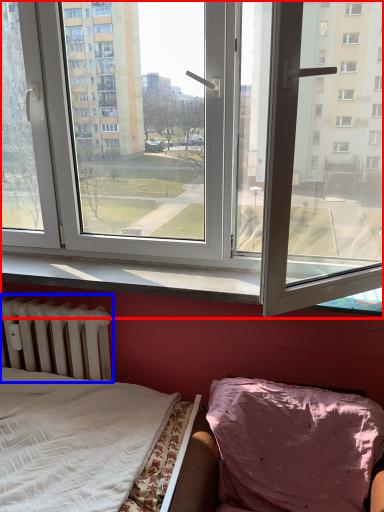
Question: Which of the following is the farthest to the observer, window (highlighted by a red box) or radiator (highlighted by a blue box)?

Choices:
 (A) window
 (B) radiator

Answer: (B)